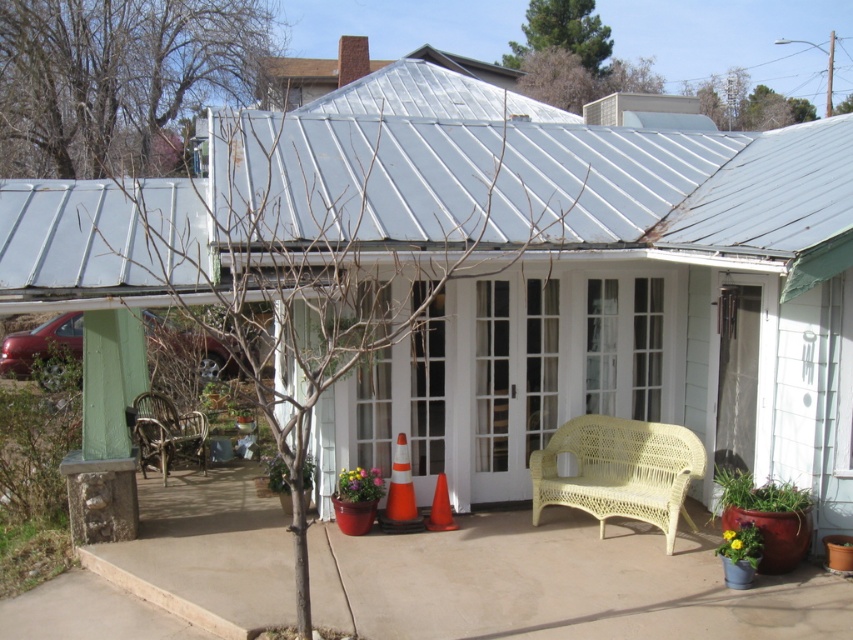
You are a delivery person trying to place a large package on the patio. The package is 1.2 meters wide. Can you place it between the rattan chair at lower left and the orange plastic cone at center without moving any objects?

The orange plastic cone at center is behind the rattan chair at lower left, so there is no space between them for the package. You cannot place the package between the rattan chair at lower left and the orange plastic cone at center without moving objects.

You are standing at the center of the patio in front of the house. You want to sit down on the rattan chair at lower left. Which direction should you walk to reach it?

You should walk to the left to reach the rattan chair at lower left since it is positioned at lower left relative to your starting position at the center of the patio.